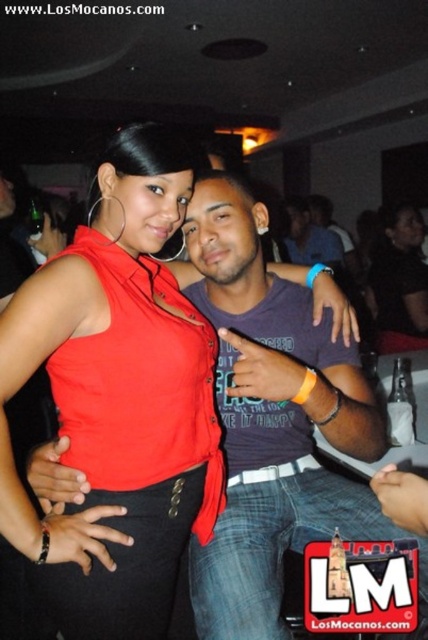
Question: In this image, where is matte purple shirt at center located relative to matte black top at center?

Choices:
 (A) left
 (B) right

Answer: (A)

Question: Which object appears closest to the camera in this image?

Choices:
 (A) purple cotton shirt at center
 (B) satin red top at center
 (C) matte black top at center
 (D) matte purple shirt at center

Answer: (B)

Question: Is satin red top at center below matte black top at center?

Choices:
 (A) no
 (B) yes

Answer: (B)

Question: Is matte purple shirt at center to the left of matte black top at center from the viewer's perspective?

Choices:
 (A) yes
 (B) no

Answer: (A)

Question: Which object is closer to the camera taking this photo?

Choices:
 (A) satin red top at center
 (B) matte black top at center
 (C) purple cotton shirt at center

Answer: (A)

Question: Which object appears closest to the camera in this image?

Choices:
 (A) purple cotton shirt at center
 (B) satin red top at center
 (C) matte black top at center

Answer: (B)